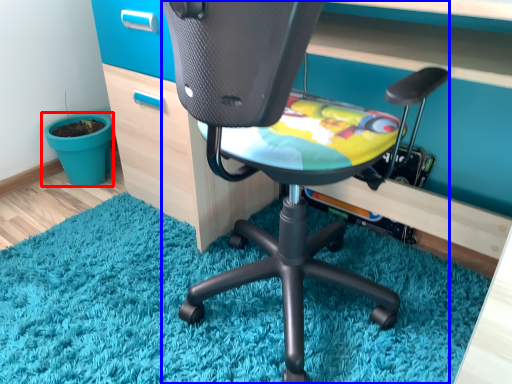
Question: Which point is further to the camera, flowerpot (highlighted by a red box) or chair (highlighted by a blue box)?

Choices:
 (A) flowerpot
 (B) chair

Answer: (A)